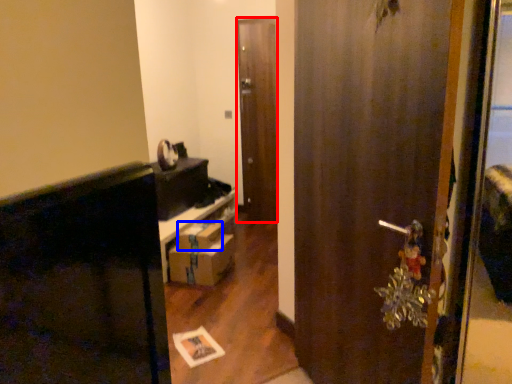
Question: Among these objects, which one is farthest to the camera, door (highlighted by a red box) or box (highlighted by a blue box)?

Choices:
 (A) door
 (B) box

Answer: (A)